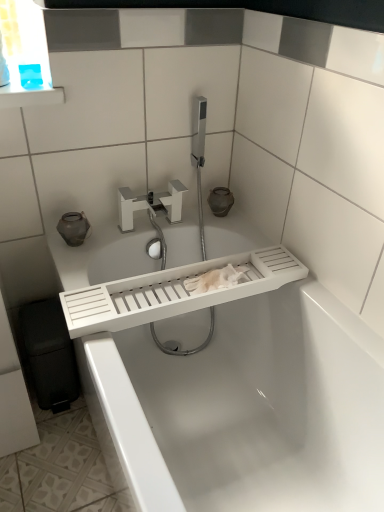
Image resolution: width=384 pixels, height=512 pixels. Describe the element at coordinates (150, 204) in the screenshot. I see `white matte faucet at center` at that location.

Locate an element on the screen. white matte faucet at center is located at coordinates 150,204.

Locate an element on the screen. white plastic bathtub at center is located at coordinates (245, 408).

What do you see at coordinates (245, 408) in the screenshot?
I see `white plastic bathtub at center` at bounding box center [245, 408].

Identify the location of white matte faucet at center. (150, 204).

Would you say white matte faucet at center is to the left or to the right of white plastic bathtub at center in the picture?

In the image, white matte faucet at center appears on the left side of white plastic bathtub at center.

Does white matte faucet at center lie behind white plastic bathtub at center?

Yes, white matte faucet at center is behind white plastic bathtub at center.

Considering the points (168, 186) and (157, 263), which point is in front, point (168, 186) or point (157, 263)?

The point (168, 186) is closer.

From the image's perspective, relative to white plastic bathtub at center, is white matte faucet at center above or below?

Based on their image positions, white matte faucet at center is located above white plastic bathtub at center.

From a real-world perspective, is white matte faucet at center positioned over white plastic bathtub at center based on gravity?

Yes, from a real-world perspective, white matte faucet at center is on top of white plastic bathtub at center.

Considering the sizes of objects white matte faucet at center and white plastic bathtub at center in the image provided, who is wider, white matte faucet at center or white plastic bathtub at center?

With larger width is white plastic bathtub at center.

Is white matte faucet at center taller than white plastic bathtub at center?

In fact, white matte faucet at center may be shorter than white plastic bathtub at center.

Considering the sizes of objects white matte faucet at center and white plastic bathtub at center in the image provided, who is bigger, white matte faucet at center or white plastic bathtub at center?

Bigger between the two is white plastic bathtub at center.

Consider the image. Would you say white plastic bathtub at center is part of white matte faucet at center's contents?

No.

Does white matte faucet at center touch white plastic bathtub at center?

They are not placed beside each other.

Does white matte faucet at center turn towards white plastic bathtub at center?

No.

What's the angular difference between white matte faucet at center and white plastic bathtub at center's facing directions?

They differ by 88.9 degrees in their facing directions.

Where is `tap above the white plastic bathtub at center (from the image's perspective)`? tap above the white plastic bathtub at center (from the image's perspective) is located at coordinates (150, 204).

Is white plastic bathtub at center to the left of white matte faucet at center from the viewer's perspective?

No.

Considering the positions of objects white plastic bathtub at center and white matte faucet at center in the image provided, who is behind, white plastic bathtub at center or white matte faucet at center?

white matte faucet at center is behind.

Is point (357, 339) farther from camera compared to point (121, 198)?

That is False.

In the scene shown: From the image's perspective, which is below, white plastic bathtub at center or white matte faucet at center?

white plastic bathtub at center appears lower in the image.

From a real-world perspective, is white plastic bathtub at center above or below white matte faucet at center?

Clearly, from a real-world perspective, white plastic bathtub at center is below white matte faucet at center.

Which object is wider, white plastic bathtub at center or white matte faucet at center?

Wider between the two is white plastic bathtub at center.

Considering the relative sizes of white plastic bathtub at center and white matte faucet at center in the image provided, is white plastic bathtub at center shorter than white matte faucet at center?

No, white plastic bathtub at center is not shorter than white matte faucet at center.

Who is smaller, white plastic bathtub at center or white matte faucet at center?

white matte faucet at center is smaller.

Is white plastic bathtub at center located outside white matte faucet at center?

Yes, white plastic bathtub at center is outside of white matte faucet at center.

Is white plastic bathtub at center in contact with white matte faucet at center?

No, white plastic bathtub at center is not with white matte faucet at center.

Is white plastic bathtub at center facing away from white matte faucet at center?

No, white plastic bathtub at center is not facing the opposite direction of white matte faucet at center.

Can you tell me how much white plastic bathtub at center and white matte faucet at center differ in facing direction?

The angle between the facing direction of white plastic bathtub at center and the facing direction of white matte faucet at center is 88.9 degrees.

Find the location of a particular element. Image resolution: width=384 pixels, height=512 pixels. bathtub on the right side of white matte faucet at center is located at coordinates (245, 408).

The height and width of the screenshot is (512, 384). I want to click on tap behind the white plastic bathtub at center, so click(150, 204).

The width and height of the screenshot is (384, 512). Find the location of `bathtub below the white matte faucet at center (from a real-world perspective)`. bathtub below the white matte faucet at center (from a real-world perspective) is located at coordinates (245, 408).